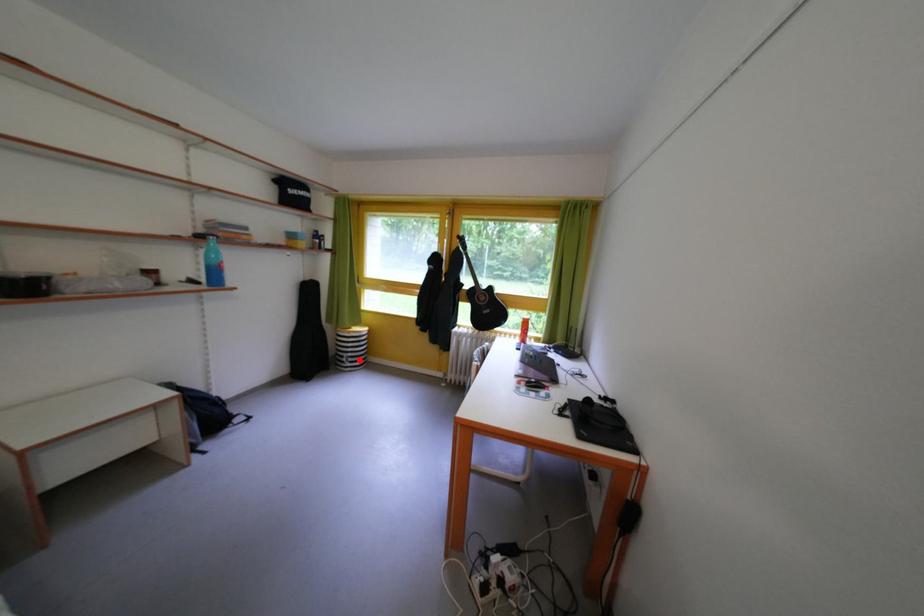
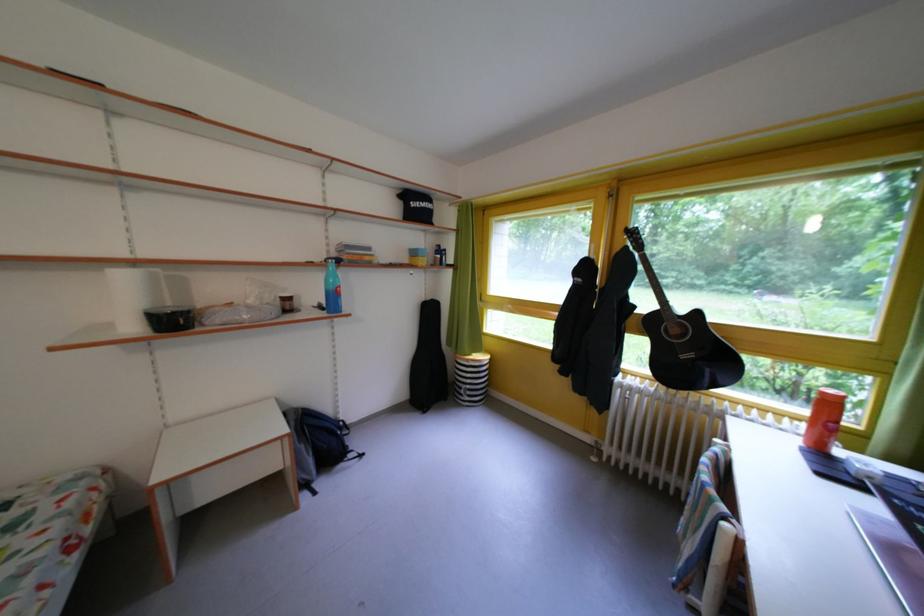
Locate, in the second image, the point that corresponds to the highlighted location in the first image.

(478, 392)